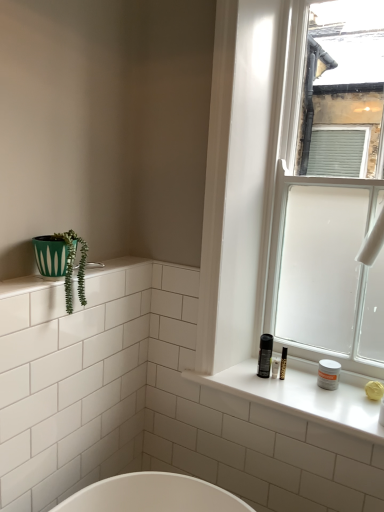
Question: Relative to green matte pot at left, is white matte jar at window, which is counted as the 2th toiletry, starting from the left, in front or behind?

Choices:
 (A) behind
 (B) front

Answer: (A)

Question: Does point pyautogui.click(x=321, y=370) appear closer or farther from the camera than point pyautogui.click(x=54, y=233)?

Choices:
 (A) farther
 (B) closer

Answer: (A)

Question: Which object is positioned closest to the white glass window at right?

Choices:
 (A) green matte pot at left
 (B) white glossy window sill at right
 (C) matte black spray can at right, arranged as the first toiletry when viewed from the left
 (D) white matte jar at window, which is the 1th toiletry in right-to-left order

Answer: (B)

Question: Which object is the farthest from the white matte jar at window, which is the 1th toiletry in right-to-left order?

Choices:
 (A) white glass window at right
 (B) matte black spray can at right, positioned as the 2th toiletry in right-to-left order
 (C) green matte pot at left
 (D) white glossy window sill at right

Answer: (C)